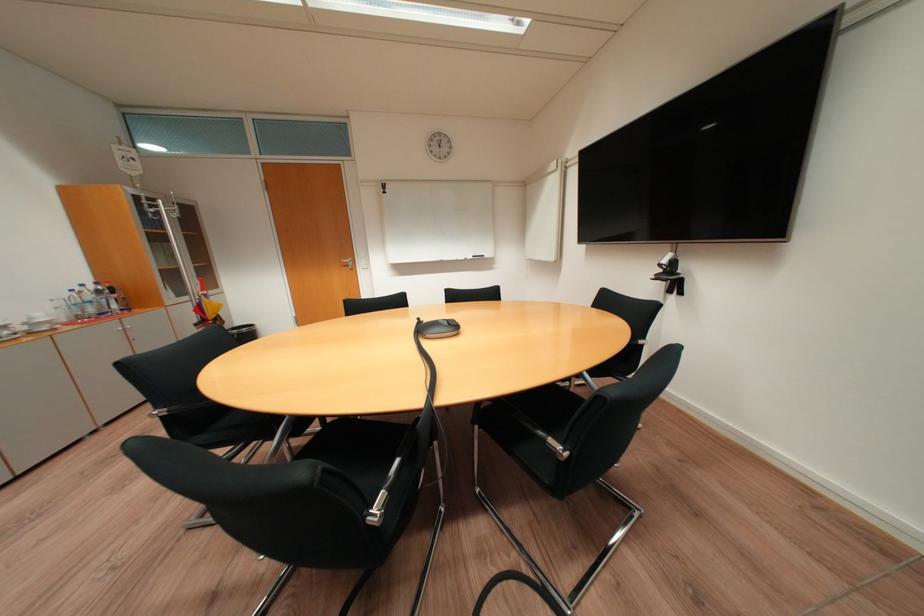
Where would you pull the silver door handle? Please return your answer as a coordinate pair (x, y).

(347, 262)